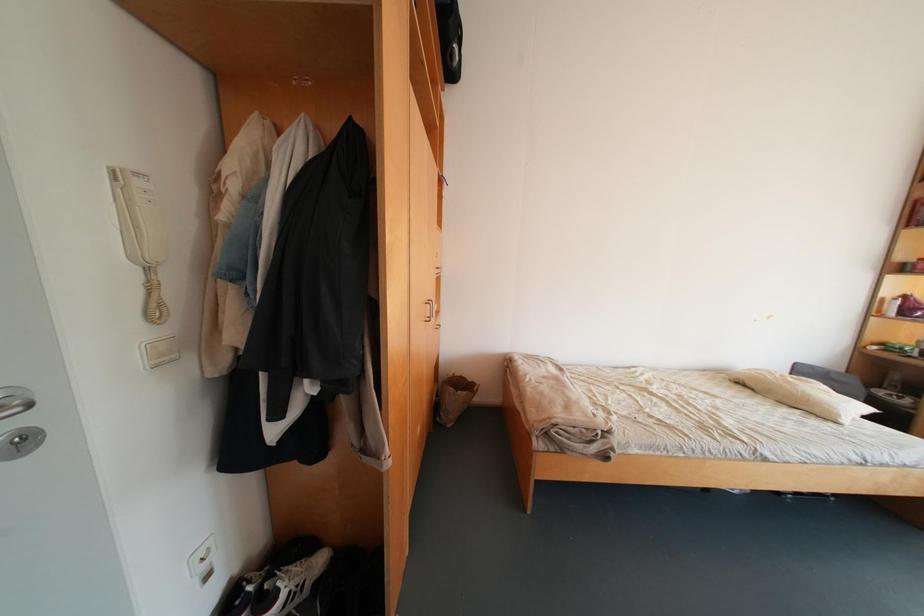
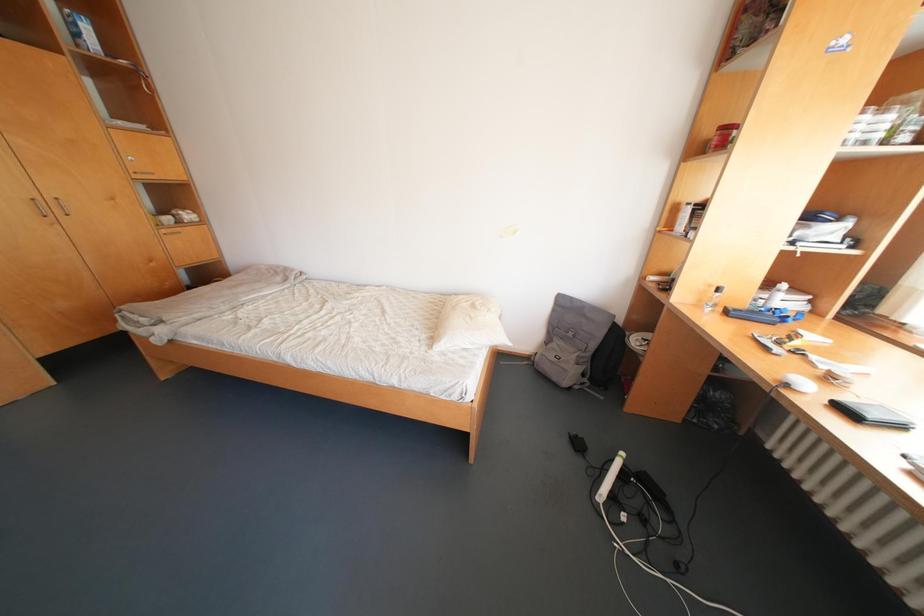
Question: What movement of the cameraman would produce the second image?

Choices:
 (A) Left
 (B) Right
 (C) Forward
 (D) Backward

Answer: (B)